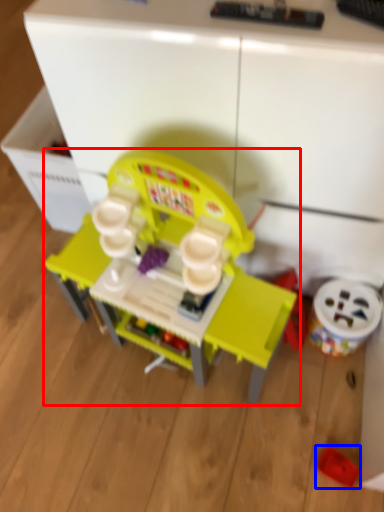
Question: Which of the following is the closest to the observer, toy (highlighted by a red box) or toy (highlighted by a blue box)?

Choices:
 (A) toy
 (B) toy

Answer: (A)